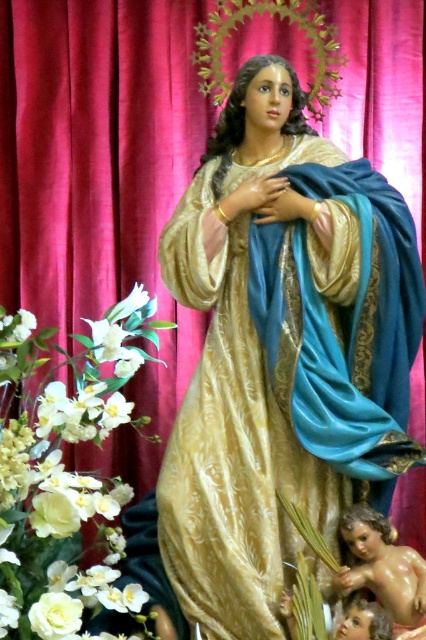
You are an interior designer planning to place a 50 feet long sofa in the living room. The sofa will be positioned between the gold satin robe at center and the white silk flower at center. Based on the scene description, will the sofa fit between them?

The gold satin robe at center is 44.78 feet from the white silk flower at center, so the sofa is 50 feet long which is longer than the distance between them. Therefore, the sofa will not fit between the gold satin robe at center and the white silk flower at center.

You are an art curator examining the statue arrangement. You need to determine the spatial relationship between the gold satin robe at center and the smooth beige baby at lower right. Which object is positioned closer to the viewer?

The gold satin robe at center is closer to the viewer than the smooth beige baby at lower right because the baby is behind the robe.